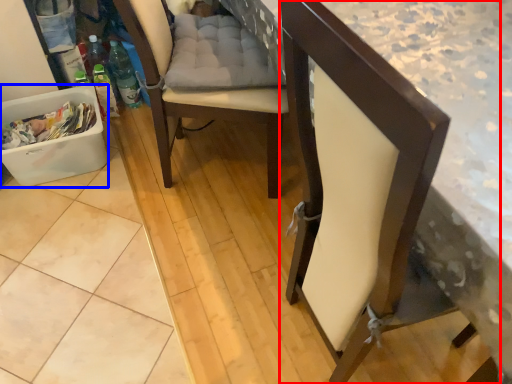
Question: Which object is closer to the camera taking this photo, chair (highlighted by a red box) or laundry basket (highlighted by a blue box)?

Choices:
 (A) chair
 (B) laundry basket

Answer: (A)